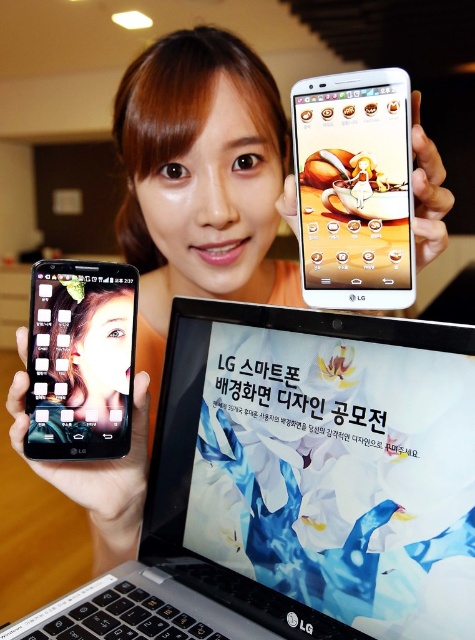
The height and width of the screenshot is (640, 475). Describe the element at coordinates (297, 484) in the screenshot. I see `black plastic laptop at center` at that location.

Does point (335, 342) come behind point (79, 285)?

No.

Find the location of `black plastic laptop at center`. black plastic laptop at center is located at coordinates (297, 484).

Measure the distance between point (378, 134) and camera.

Point (378, 134) and camera are 17.98 inches apart from each other.

Does point (379, 237) come farther from viewer compared to point (63, 396)?

No, it is not.

The height and width of the screenshot is (640, 475). What are the coordinates of `white glossy tablet at upper center` in the screenshot? It's located at (354, 189).

In the scene shown: Measure the distance between black plastic laptop at center and camera.

black plastic laptop at center and camera are 15.66 inches apart from each other.

Does black plastic laptop at center have a smaller size compared to white glossy tablet at upper center?

No.

Which is in front, point (359, 380) or point (304, 125)?

Point (359, 380)

The width and height of the screenshot is (475, 640). Find the location of `black plastic laptop at center`. black plastic laptop at center is located at coordinates (297, 484).